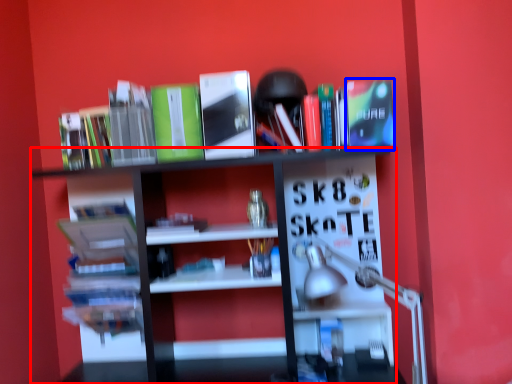
Question: Which object is further to the camera taking this photo, shelf (highlighted by a red box) or paperback book (highlighted by a blue box)?

Choices:
 (A) shelf
 (B) paperback book

Answer: (B)